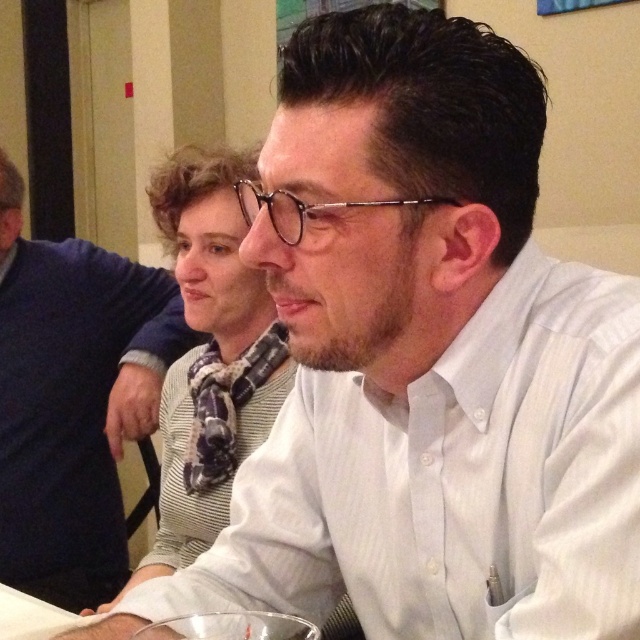
Where is `white shirt at upper center`? The width and height of the screenshot is (640, 640). white shirt at upper center is located at coordinates (74, 401).